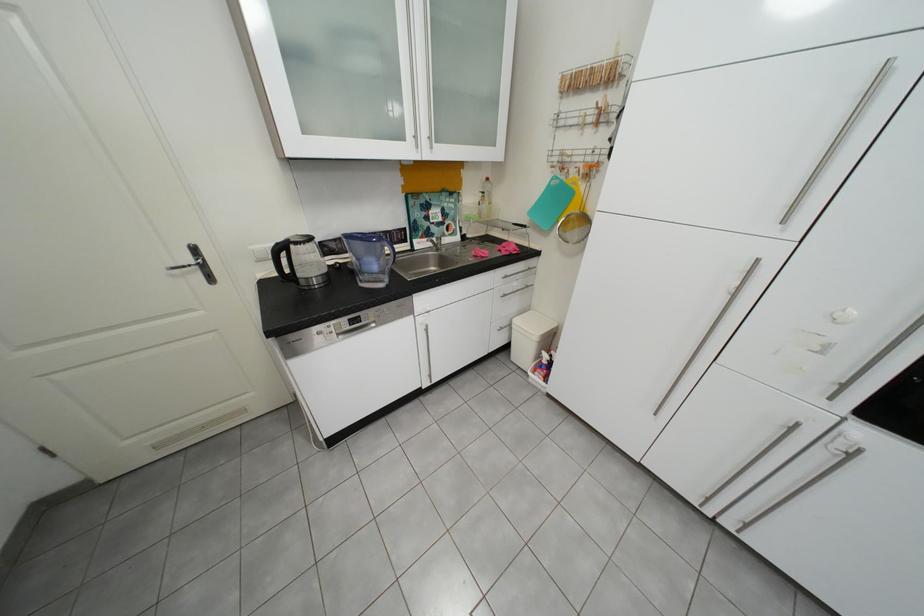
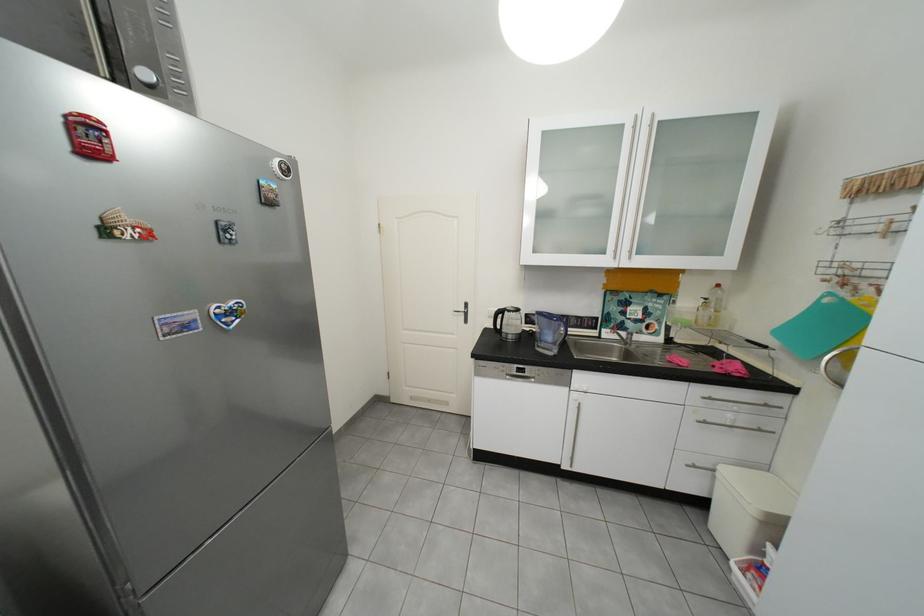
Locate, in the second image, the point that corresponds to (x=185, y=277) in the first image.

(466, 315)